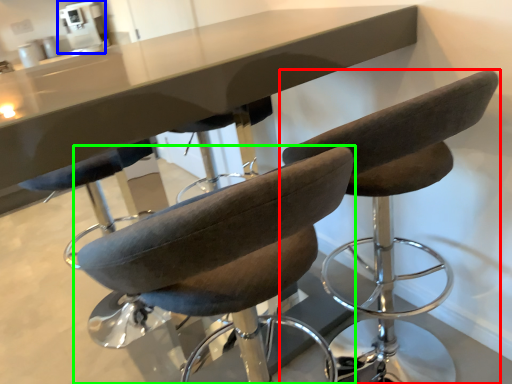
Question: Considering the real-world distances, which object is closest to chair (highlighted by a red box)? coffee machine (highlighted by a blue box) or chair (highlighted by a green box).

Choices:
 (A) coffee machine
 (B) chair

Answer: (B)